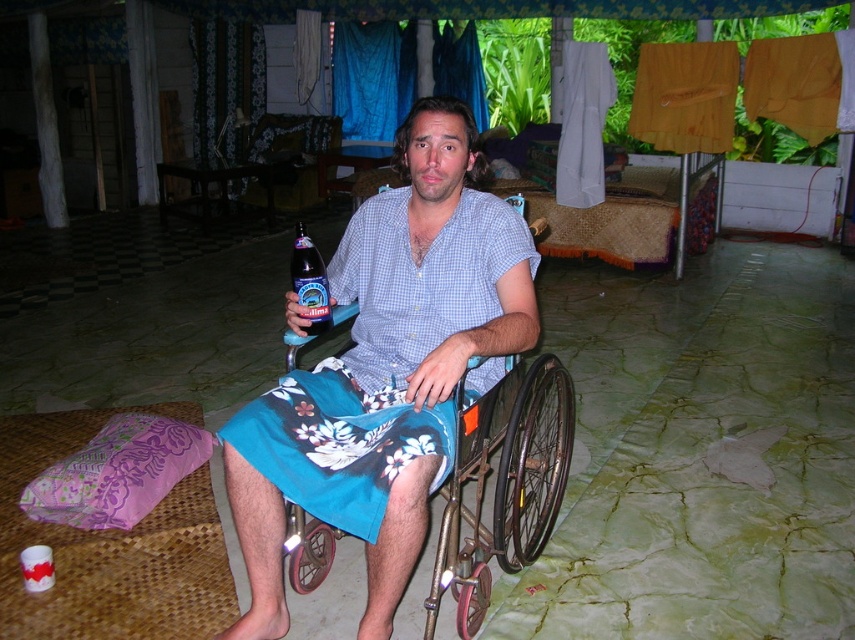
You are a photographer trying to capture the blue floral shorts at center in the image. Where exactly should you focus your camera to ensure the shorts are in the frame?

You should focus your camera at point 0.583 on the x axis and 0.451 on the y axis to capture the blue floral shorts at center.

You are a photographer setting up a shot of the man in the wheelchair. You need to ensure the blue checkered shirt at center and the dark blue glass bottle at center are both visible in the frame. Which object should you focus on first to ensure both are in focus?

The blue checkered shirt at center is taller than the dark blue glass bottle at center, so you should focus on the blue checkered shirt at center first to ensure both are in focus.

Looking at this image, based on the scene described, can you determine the spatial relationship between the blue checkered shirt at center and the dark blue glass bottle at center?

The blue checkered shirt at center is to the right of the dark blue glass bottle at center.